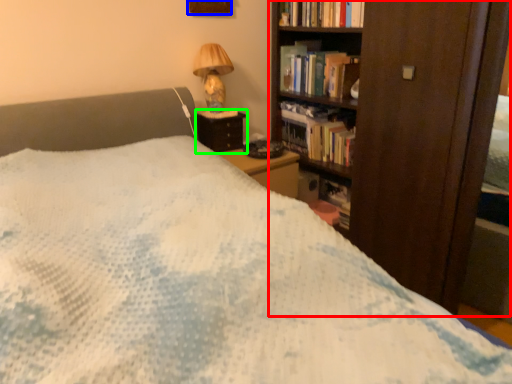
Question: Which is nearer to the bookcase (highlighted by a red box)? picture frame (highlighted by a blue box) or nightstand (highlighted by a green box).

Choices:
 (A) picture frame
 (B) nightstand

Answer: (B)